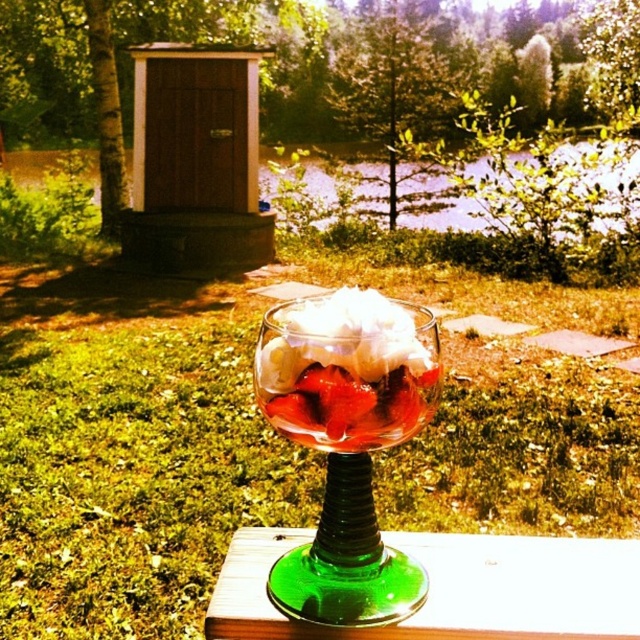
Question: Does green glass wine glass at center come behind green glass table at center?

Choices:
 (A) yes
 (B) no

Answer: (B)

Question: Which point appears farthest from the camera in this image?

Choices:
 (A) (262, 628)
 (B) (356, 394)
 (C) (314, 378)

Answer: (A)

Question: Can you confirm if green glass wine glass at center is bigger than green glass table at center?

Choices:
 (A) yes
 (B) no

Answer: (A)

Question: Is green glass table at center positioned at the back of clear glass bowl at center?

Choices:
 (A) no
 (B) yes

Answer: (B)

Question: Which object appears farthest from the camera in this image?

Choices:
 (A) green glass table at center
 (B) clear glass bowl at center

Answer: (A)

Question: Which point is farther to the camera?

Choices:
 (A) clear glass bowl at center
 (B) green glass wine glass at center
 (C) green glass table at center

Answer: (C)